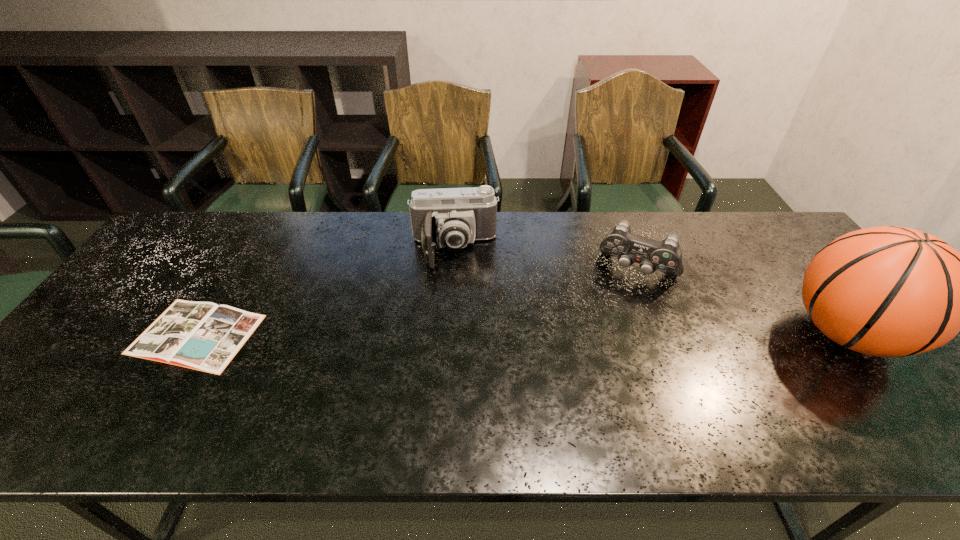
In order to click on free spot between the third object from right to left and the leftmost object in this screenshot , I will do `click(325, 292)`.

This screenshot has width=960, height=540. Identify the location of free space between the third object from left to right and the leftmost object. (418, 302).

This screenshot has height=540, width=960. I want to click on vacant space in between the book and the third object from right to left, so click(325, 292).

Locate an element on the screen. vacant space that's between the third tallest object and the shortest object is located at coordinates (418, 302).

Identify the location of free space between the shortest object and the basketball. (521, 334).

Identify the location of free space between the control and the leftmost object. (418, 302).

This screenshot has width=960, height=540. Find the location of `free spot between the third tallest object and the camera`. free spot between the third tallest object and the camera is located at coordinates (546, 260).

Where is `vacant space in between the rightmost object and the second object from left to right`? The width and height of the screenshot is (960, 540). vacant space in between the rightmost object and the second object from left to right is located at coordinates (650, 292).

Image resolution: width=960 pixels, height=540 pixels. In order to click on free space between the tallest object and the shortest object in this screenshot , I will do `click(521, 334)`.

Select which object is the closest to the second shortest object. Please provide its 2D coordinates. Your answer should be formatted as a tuple, i.e. [(x, y)], where the tuple contains the x and y coordinates of a point satisfying the conditions above.

[(887, 291)]